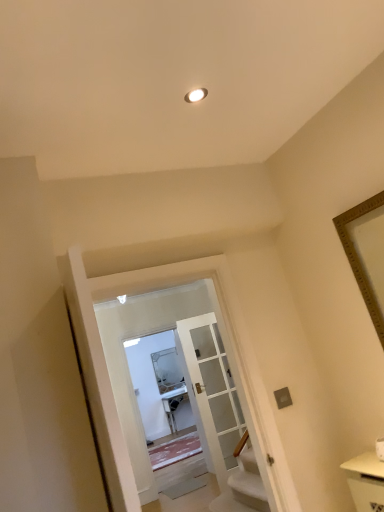
At what (x,y) coordinates should I click in order to perform the action: click on white glass door at center. Please return your answer as a coordinate pair (x, y). Looking at the image, I should click on (218, 410).

What do you see at coordinates (218, 410) in the screenshot? This screenshot has height=512, width=384. I see `white glass door at center` at bounding box center [218, 410].

Where is `white glass door at center`? The height and width of the screenshot is (512, 384). white glass door at center is located at coordinates (218, 410).